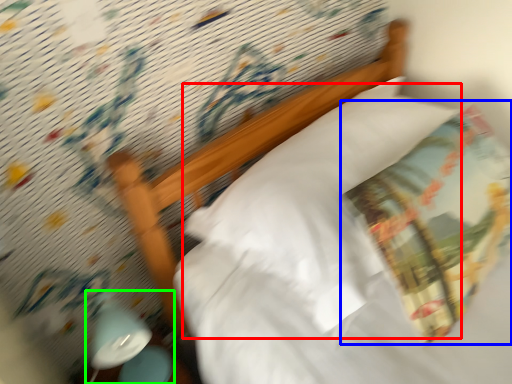
Question: Which object is positioned closest to pillow (highlighted by a red box)? Select from throw pillow (highlighted by a blue box) and bedside lamp (highlighted by a green box).

Choices:
 (A) throw pillow
 (B) bedside lamp

Answer: (A)